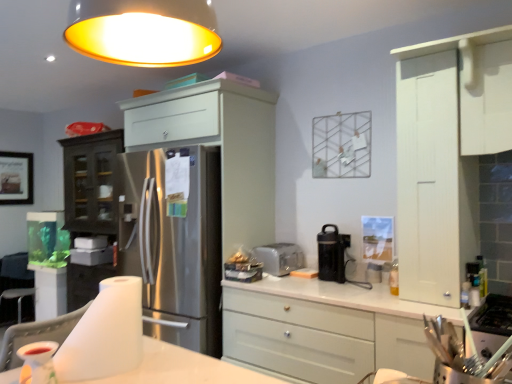
At what (x,y) coordinates should I click in order to perform the action: click on blank space situated above white glossy table at lower center (from a real-world perspective). Please return your answer as a coordinate pair (x, y). This screenshot has height=384, width=512. Looking at the image, I should click on (186, 367).